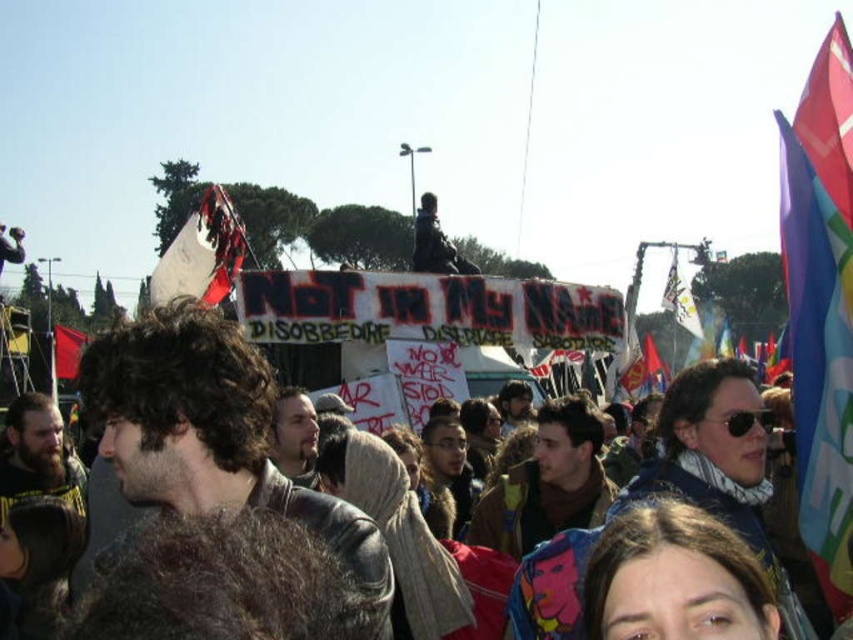
Based on the scene description, where is the polyester flag at right located in the image?

The polyester flag at right is located at point (821,301) in the image.

You are a photographer trying to capture the protest scene. You want to focus on the red fabric flag at left without the rusty metal sign at upper left blocking it. Is there a way to adjust your position to achieve this?

The rusty metal sign at upper left is in front of the red fabric flag at left. To avoid the sign blocking the flag, you should move to a position where the sign is no longer between you and the flag. This could involve shifting your angle or moving closer to the flag so that the sign is no longer in the foreground.

You are a photographer trying to capture a photo of both the polyester flag at right and the red fabric flag at left in the same frame. Your camera has a focal length of 50mm. Given that the minimum distance between objects in the frame should be at least 10 meters to avoid blurring, can you take the photo with the current setup?

The polyester flag at right is 98.65 meters away from the red fabric flag at left. Since the minimum required distance is 10 meters and the actual distance is much greater, the photographer can safely take the photo without blurring.